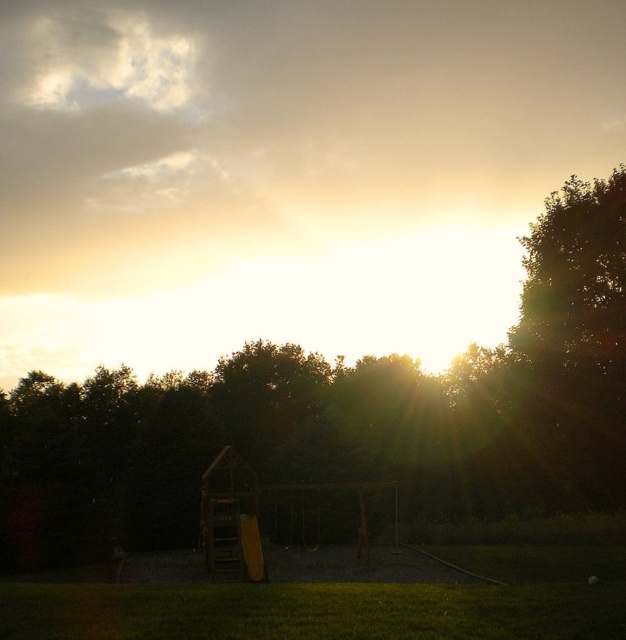
You are standing in the serene outdoor scene at sunset. There are two points marked in the image. The first point is at coordinates point (239, 520) and the second is at point (300, 520). Which of these two points is closer to you?

Point (239, 520) is closer to the camera than point (300, 520).

You are standing in the middle of the scene described. Looking towards the horizon, you notice a point marked at coordinates point (x=344, y=416). What object is located at that specific coordinate?

The point (x=344, y=416) marks a dark green leafy tree at center.